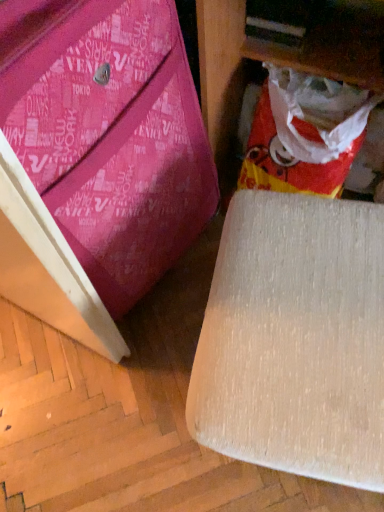
Question: In the image, is pink fabric bag at lower left, which ranks as the 1th furniture in left-to-right order, positioned in front of or behind red/yellow plastic bag at lower right?

Choices:
 (A) behind
 (B) front

Answer: (B)

Question: Is point (24, 122) positioned closer to the camera than point (261, 163)?

Choices:
 (A) closer
 (B) farther

Answer: (A)

Question: Considering the real-world distances, which object is closest to the beige fabric chair at lower right, which is the 2th furniture in left-to-right order?

Choices:
 (A) red/yellow plastic bag at lower right
 (B) pink fabric bag at lower left, acting as the 2th furniture starting from the right

Answer: (B)

Question: Estimate the real-world distances between objects in this image. Which object is closer to the pink fabric bag at lower left, which ranks as the 1th furniture in left-to-right order?

Choices:
 (A) beige fabric chair at lower right, which is the 2th furniture in left-to-right order
 (B) red/yellow plastic bag at lower right

Answer: (A)